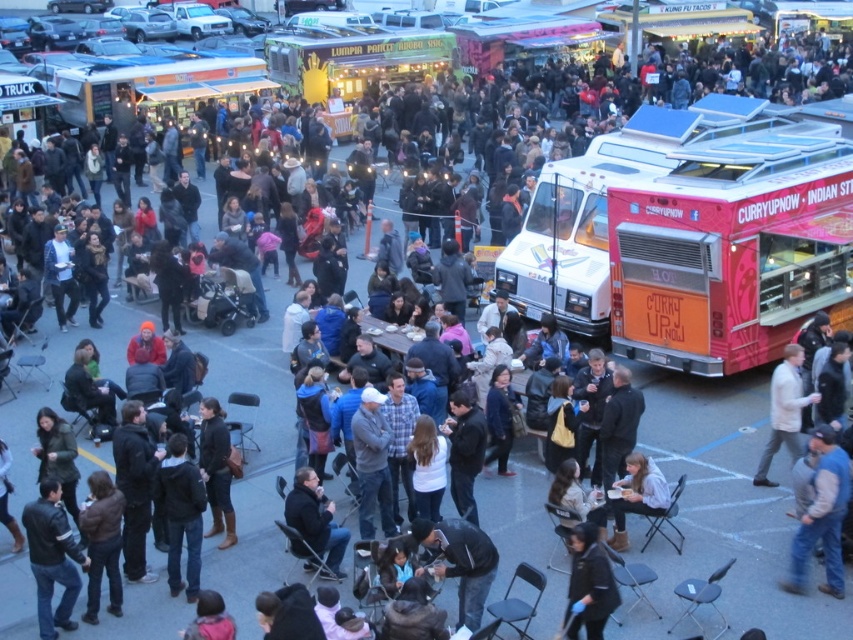
You are a photographer at the food truck event. You want to take a photo of the leather jacket at lower left without the blue denim jacket at lower right blocking it. What should you do?

Move to the left side so that the leather jacket at lower left is no longer behind the blue denim jacket at lower right.

You are standing at the food truck event and want to reach the point marked at coordinates (366, 435). How far will you have to walk from your current position?

The point at coordinates (366, 435) is 11.82 meters away from your current position.